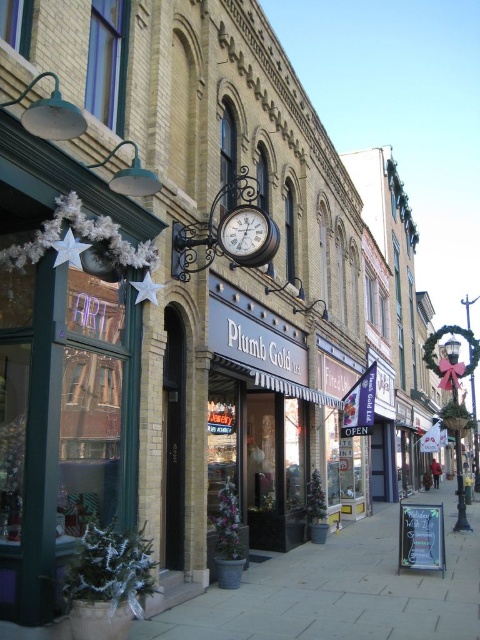
You are a delivery person carrying a large package and need to place it on the surface that can hold heavy items. Which object between the smooth concrete sidewalk at center and the matte black clock at center should you choose?

The smooth concrete sidewalk at center has a larger size compared to matte black clock at center, so it is more suitable for placing heavy items.

You are a delivery person trying to park your bike near the ART store. The bike stand is located on the smooth concrete sidewalk at center. To reach it, you need to walk from the matte black clock at center. Which direction should you move relative to the clock?

The smooth concrete sidewalk at center is to the right of the matte black clock at center, so you should move to the right of the matte black clock at center to reach the bike stand.